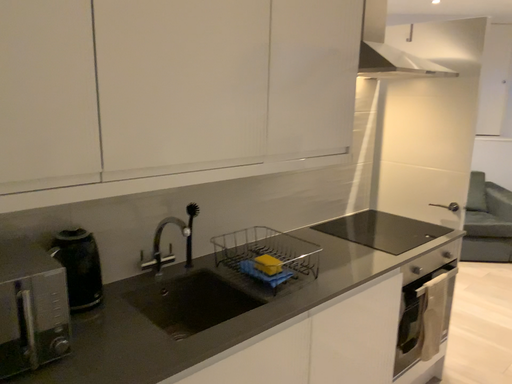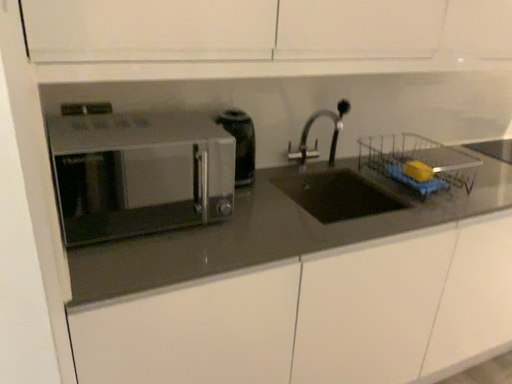
Question: Which way did the camera rotate in the video?

Choices:
 (A) rotated right
 (B) rotated left

Answer: (B)